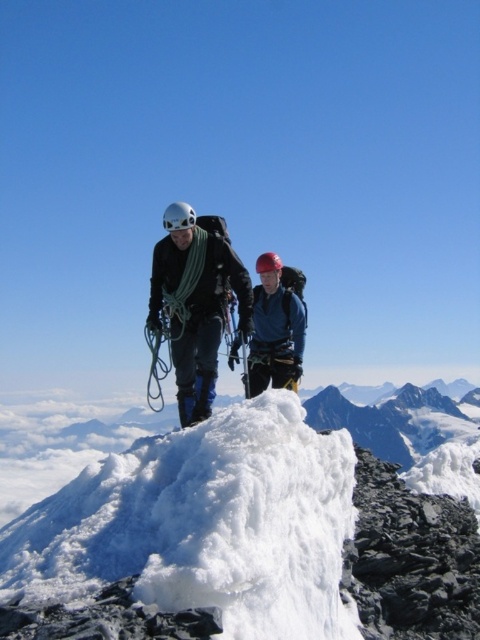
Is point (113, 570) farther from camera compared to point (216, 248)?

That is False.

Is white fluffy snow at center above matte black jacket at center?

Actually, white fluffy snow at center is below matte black jacket at center.

You are a GUI agent. You are given a task and a screenshot of the screen. Output one action in this format:
    pyautogui.click(x=<x>, y=<y>)
    Task: Click on the white fluffy snow at center
    This screenshot has height=640, width=480.
    Given the screenshot: What is the action you would take?
    pyautogui.click(x=262, y=531)

Measure the distance between white fluffy snow at center and matte blue jacket at center.

white fluffy snow at center and matte blue jacket at center are 11.33 meters apart from each other.

Is the position of white fluffy snow at center less distant than that of matte blue jacket at center?

Yes.

Is point (100, 465) farther from viewer compared to point (285, 292)?

No.

Image resolution: width=480 pixels, height=640 pixels. What are the coordinates of `white fluffy snow at center` in the screenshot? It's located at [262, 531].

The width and height of the screenshot is (480, 640). What do you see at coordinates (196, 301) in the screenshot?
I see `matte black jacket at center` at bounding box center [196, 301].

Is matte black jacket at center positioned in front of matte blue jacket at center?

Yes, matte black jacket at center is in front of matte blue jacket at center.

Is point (223, 285) more distant than point (299, 275)?

No, (223, 285) is in front of (299, 275).

This screenshot has height=640, width=480. I want to click on matte black jacket at center, so click(196, 301).